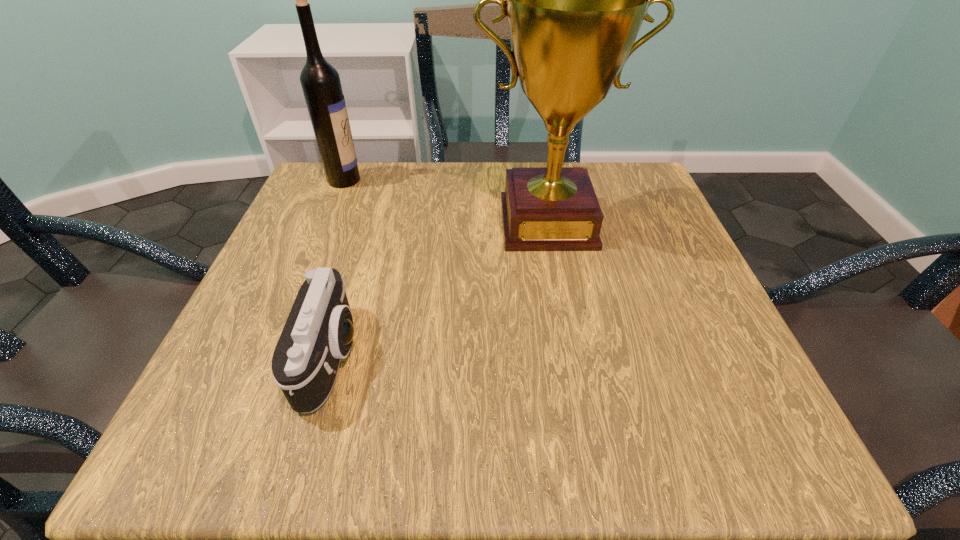
Locate an element on the screen. This screenshot has height=540, width=960. vacant space that satisfies the following two spatial constraints: 1. on the plaque of the second nearest object; 2. on the front lens of the camera is located at coordinates (572, 356).

You are a GUI agent. You are given a task and a screenshot of the screen. Output one action in this format:
    pyautogui.click(x=<x>, y=<y>)
    Task: Click on the free space that satisfies the following two spatial constraints: 1. on the plaque of the award; 2. on the front lens of the second object from right to left
    The width and height of the screenshot is (960, 540).
    Given the screenshot: What is the action you would take?
    pyautogui.click(x=572, y=356)